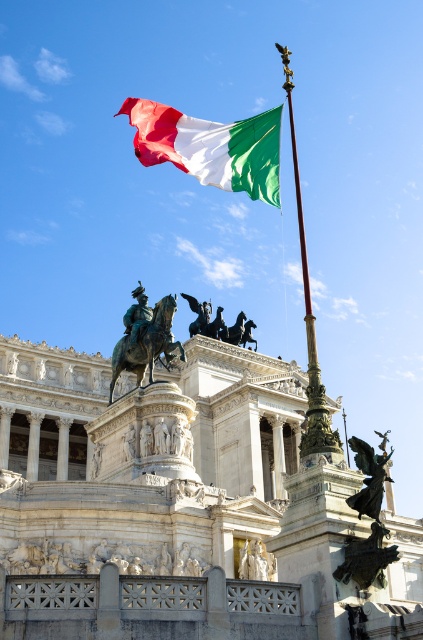
Between point (288, 577) and point (239, 548), which one is positioned in front?

Positioned in front is point (288, 577).

Is point (302, 598) farther from viewer compared to point (246, 548)?

No, (302, 598) is in front of (246, 548).

Locate an element on the screen. white marble palace at center is located at coordinates (178, 502).

Does tri-color fabric flag at upper center appear under matte white statue at lower center?

Actually, tri-color fabric flag at upper center is above matte white statue at lower center.

Image resolution: width=423 pixels, height=640 pixels. Describe the element at coordinates (211, 147) in the screenshot. I see `tri-color fabric flag at upper center` at that location.

Which is in front, point (186, 170) or point (244, 557)?

Point (186, 170)

What are the coordinates of `tri-color fabric flag at upper center` in the screenshot? It's located at coord(211,147).

Does bronze statue at lower right have a lesser height compared to matte white statue at lower center?

In fact, bronze statue at lower right may be taller than matte white statue at lower center.

Who is more distant from viewer, (395, 548) or (239, 557)?

Positioned behind is point (239, 557).

This screenshot has height=640, width=423. I want to click on bronze statue at lower right, so click(367, 557).